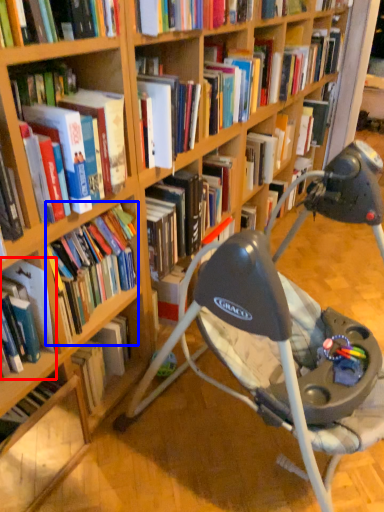
Question: Which object is further to the camera taking this photo, book (highlighted by a red box) or book (highlighted by a blue box)?

Choices:
 (A) book
 (B) book

Answer: (B)